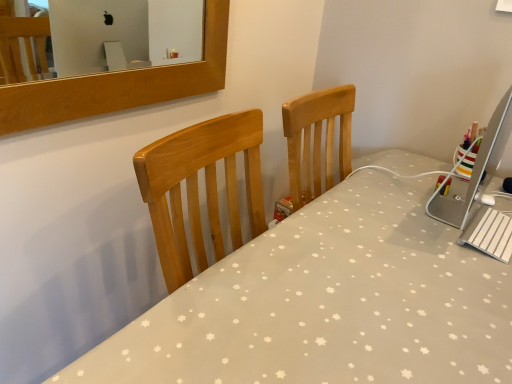
The width and height of the screenshot is (512, 384). What do you see at coordinates (328, 304) in the screenshot?
I see `white star-patterned tablecloth at center` at bounding box center [328, 304].

In order to face white star-patterned tablecloth at center, should I rotate leftwards or rightwards?

You should look right and rotate roughly 12.784 degrees.

In order to click on white star-patterned tablecloth at center in this screenshot , I will do `click(328, 304)`.

I want to click on white star-patterned tablecloth at center, so click(328, 304).